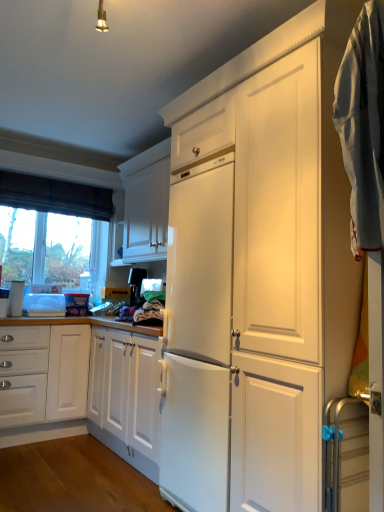
Question: From a real-world perspective, does white glossy cabinet at upper center sit lower than satin black coffee maker at center, which appears as the 1th appliance when viewed from the top?

Choices:
 (A) no
 (B) yes

Answer: (A)

Question: Can satin black coffee maker at center, which appears as the 1th appliance when viewed from the top, be found inside white glossy cabinet at upper center?

Choices:
 (A) no
 (B) yes

Answer: (A)

Question: Can you confirm if white glossy cabinet at upper center is shorter than satin black coffee maker at center, which ranks as the second appliance in right-to-left order?

Choices:
 (A) no
 (B) yes

Answer: (A)

Question: Is white glossy cabinet at upper center behind satin black coffee maker at center, acting as the 2th appliance starting from the front?

Choices:
 (A) yes
 (B) no

Answer: (B)

Question: Is white glossy cabinet at upper center not inside satin black coffee maker at center, which appears as the 1th appliance when viewed from the top?

Choices:
 (A) no
 (B) yes

Answer: (B)

Question: Choose the correct answer: Is white glossy cabinet at upper center inside satin black coffee maker at center, acting as the 2th appliance starting from the front, or outside it?

Choices:
 (A) inside
 (B) outside

Answer: (B)

Question: Visually, is white glossy cabinet at upper center positioned to the left or to the right of satin black coffee maker at center, which appears as the 1th appliance when viewed from the top?

Choices:
 (A) left
 (B) right

Answer: (A)

Question: In terms of height, does white glossy cabinet at upper center look taller or shorter compared to satin black coffee maker at center, placed as the 1th appliance when sorted from left to right?

Choices:
 (A) short
 (B) tall

Answer: (B)

Question: Is point (157, 203) positioned closer to the camera than point (134, 282)?

Choices:
 (A) farther
 (B) closer

Answer: (B)

Question: Based on their positions, is light blue cotton towel at right located to the left or right of white glossy cabinet at upper center?

Choices:
 (A) left
 (B) right

Answer: (B)

Question: In terms of width, does light blue cotton towel at right look wider or thinner when compared to white glossy cabinet at upper center?

Choices:
 (A) wide
 (B) thin

Answer: (B)

Question: In the image, is light blue cotton towel at right positioned in front of or behind white glossy cabinet at upper center?

Choices:
 (A) front
 (B) behind

Answer: (A)

Question: From a real-world perspective, is light blue cotton towel at right above or below white glossy cabinet at upper center?

Choices:
 (A) below
 (B) above

Answer: (A)

Question: Is satin black coffee maker at center, which ranks as the second appliance in right-to-left order, wider or thinner than white glossy cabinet at upper center?

Choices:
 (A) thin
 (B) wide

Answer: (A)

Question: Choose the correct answer: Is satin black coffee maker at center, acting as the second appliance starting from the bottom, inside white glossy cabinet at upper center or outside it?

Choices:
 (A) inside
 (B) outside

Answer: (B)